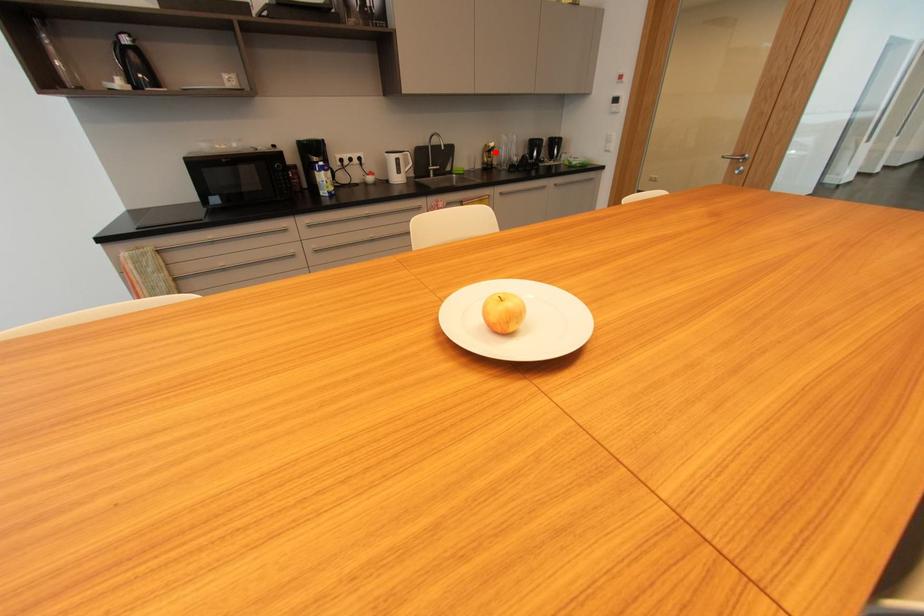
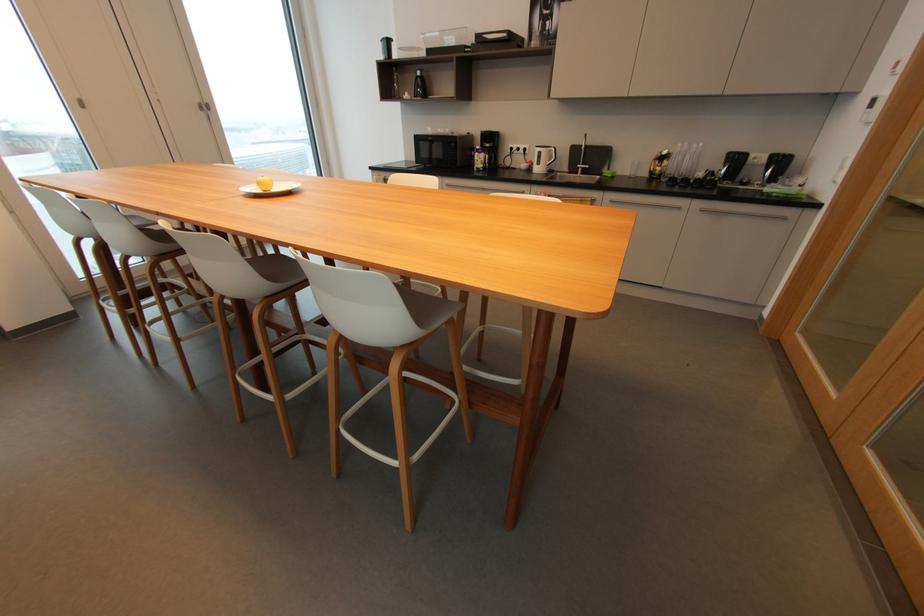
Where in the second image is the point corresponding to the highlighted location from the first image?

(669, 161)